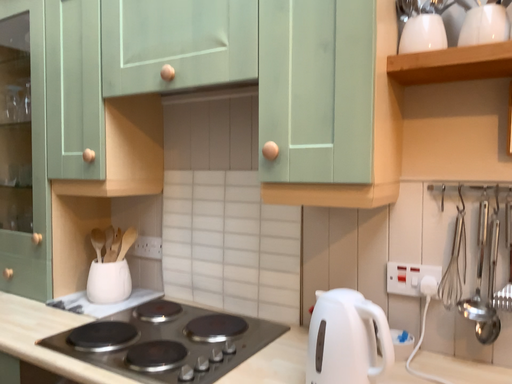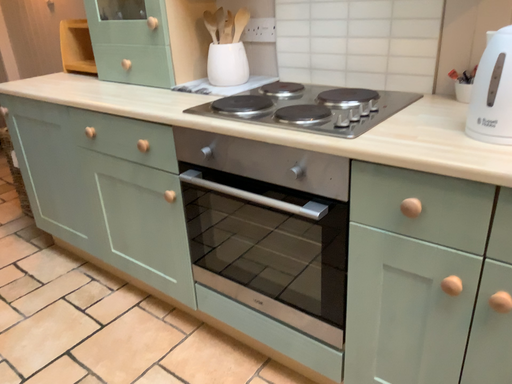
Question: Which way did the camera rotate in the video?

Choices:
 (A) rotated downward
 (B) rotated upward

Answer: (A)